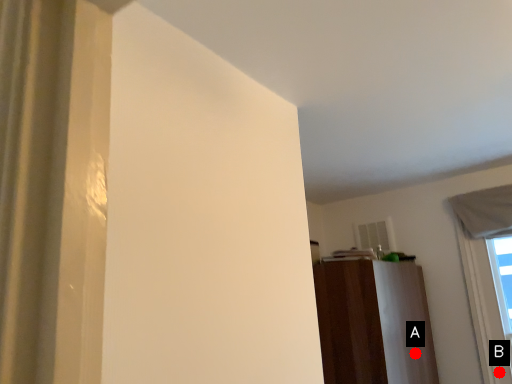
Question: Two points are circled on the image, labeled by A and B beside each circle. Which point is farther to the camera?

Choices:
 (A) A is further
 (B) B is further

Answer: (B)